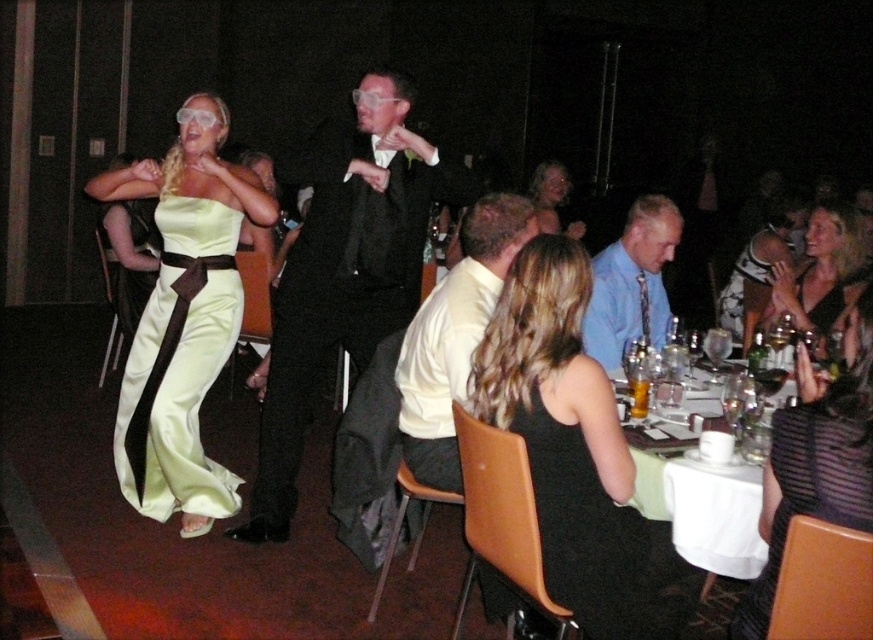
Question: Estimate the real-world distances between objects in this image. Which object is farther from the black satin dress at upper right?

Choices:
 (A) white cloth at lower right
 (B) satin dress at left
 (C) blue shirt at center

Answer: (B)

Question: Which point appears farthest from the camera in this image?

Choices:
 (A) (657, 547)
 (B) (700, 566)
 (C) (601, 250)
 (D) (853, 209)

Answer: (C)

Question: Which object appears closest to the camera in this image?

Choices:
 (A) black satin suit at center
 (B) white satin shirt at center

Answer: (B)

Question: Does satin dress at left appear over blue shirt at center?

Choices:
 (A) yes
 (B) no

Answer: (B)

Question: Is white satin shirt at center wider than blue shirt at center?

Choices:
 (A) no
 (B) yes

Answer: (A)

Question: Is blue shirt at center positioned at the back of black satin dress at upper right?

Choices:
 (A) no
 (B) yes

Answer: (B)